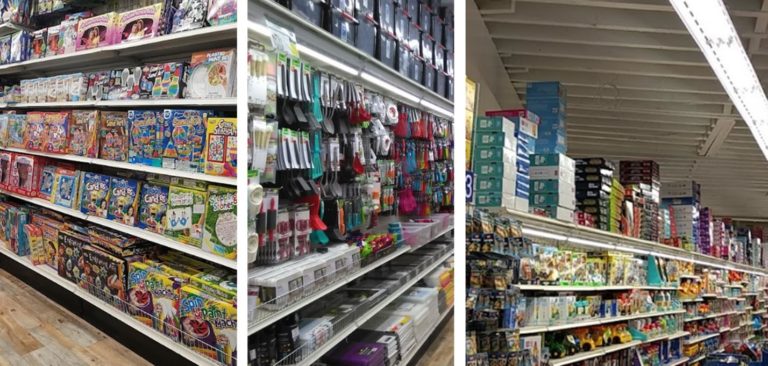
Where is `hardwood floor`? hardwood floor is located at coordinates (45, 334).